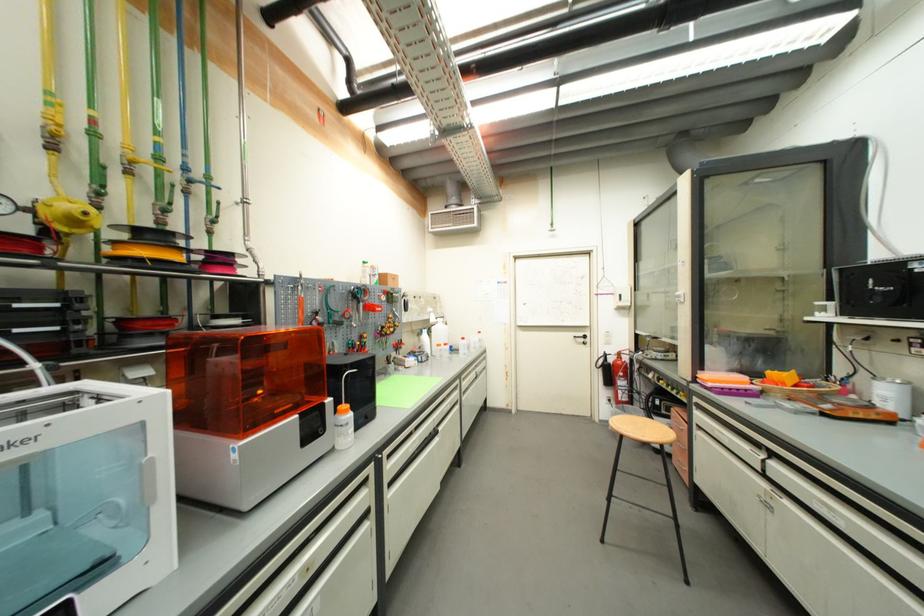
This screenshot has height=616, width=924. What are the coordinates of `black door handle` in the screenshot? It's located at (580, 338).